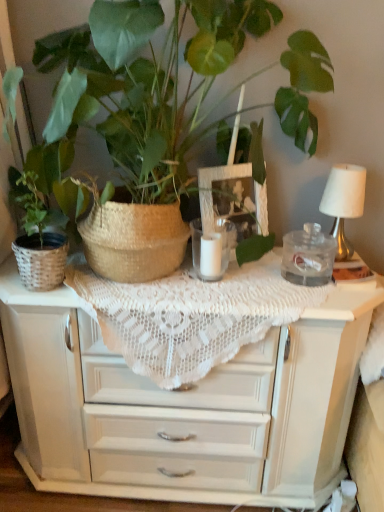
Question: Does clear glass jar at center have a greater width compared to white lace tablecloth at center?

Choices:
 (A) no
 (B) yes

Answer: (A)

Question: Considering the relative sizes of clear glass jar at center and white lace tablecloth at center in the image provided, is clear glass jar at center bigger than white lace tablecloth at center?

Choices:
 (A) no
 (B) yes

Answer: (A)

Question: Are clear glass jar at center and white lace tablecloth at center located far from each other?

Choices:
 (A) no
 (B) yes

Answer: (A)

Question: Is the position of clear glass jar at center more distant than that of white lace tablecloth at center?

Choices:
 (A) no
 (B) yes

Answer: (B)

Question: Can you confirm if clear glass jar at center is taller than white lace tablecloth at center?

Choices:
 (A) yes
 (B) no

Answer: (B)

Question: From a real-world perspective, is clear glass jar at center over white lace tablecloth at center?

Choices:
 (A) no
 (B) yes

Answer: (B)

Question: Does white lace tablecloth at center have a greater height compared to matte wicker basket at left, which ranks as the 1th houseplant in left-to-right order?

Choices:
 (A) yes
 (B) no

Answer: (B)

Question: Is white lace tablecloth at center next to matte wicker basket at left, which ranks as the 1th houseplant in left-to-right order?

Choices:
 (A) yes
 (B) no

Answer: (B)

Question: Is white lace tablecloth at center positioned behind matte wicker basket at left, placed as the second houseplant when sorted from right to left?

Choices:
 (A) no
 (B) yes

Answer: (A)

Question: Is white lace tablecloth at center to the right of matte wicker basket at left, which ranks as the 1th houseplant in left-to-right order, from the viewer's perspective?

Choices:
 (A) no
 (B) yes

Answer: (B)

Question: Is matte wicker basket at left, placed as the second houseplant when sorted from right to left, at the back of white lace tablecloth at center?

Choices:
 (A) yes
 (B) no

Answer: (B)

Question: Would you say white lace tablecloth at center contains matte wicker basket at left, which ranks as the 1th houseplant in left-to-right order?

Choices:
 (A) no
 (B) yes

Answer: (A)

Question: From a real-world perspective, is clear glass jar at center positioned over matte wicker basket at left, placed as the second houseplant when sorted from right to left, based on gravity?

Choices:
 (A) no
 (B) yes

Answer: (A)